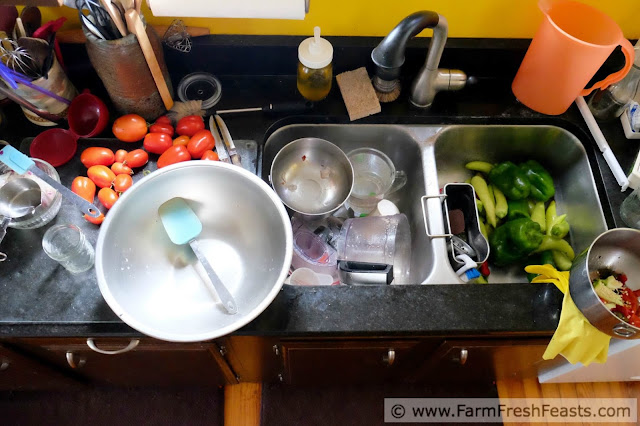
The width and height of the screenshot is (640, 426). Identify the location of measuring bowl. (368, 173).